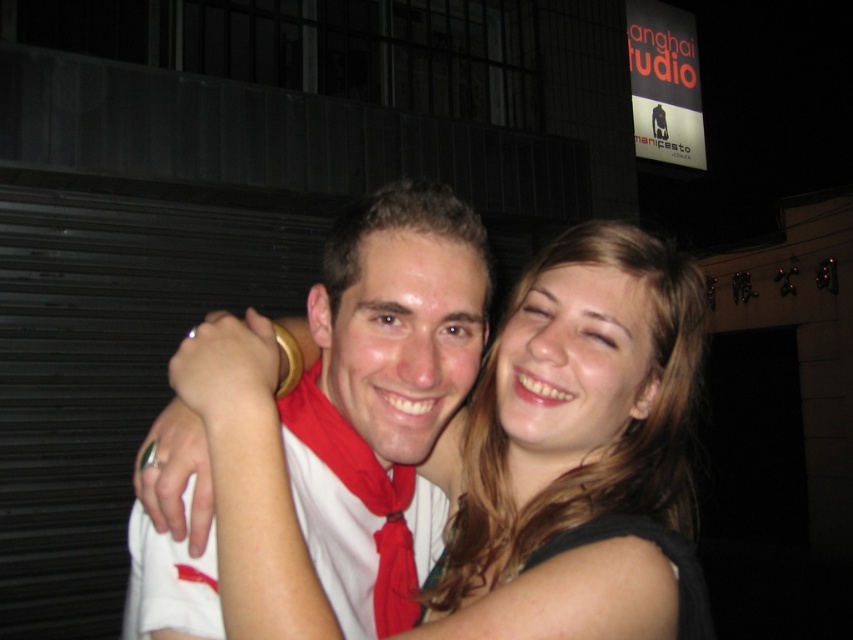
Question: Among these objects, which one is nearest to the camera?

Choices:
 (A) white matte shirt at center
 (B) blonde hair at center

Answer: (B)

Question: From the image, what is the correct spatial relationship of blonde hair at center in relation to white matte shirt at center?

Choices:
 (A) below
 (B) above

Answer: (A)

Question: Which object appears farthest from the camera in this image?

Choices:
 (A) blonde hair at center
 (B) white matte shirt at center

Answer: (B)

Question: Which point is closer to the camera?

Choices:
 (A) white matte shirt at center
 (B) blonde hair at center

Answer: (B)

Question: Can you confirm if blonde hair at center is wider than white matte shirt at center?

Choices:
 (A) yes
 (B) no

Answer: (A)

Question: Considering the relative positions of blonde hair at center and white matte shirt at center in the image provided, where is blonde hair at center located with respect to white matte shirt at center?

Choices:
 (A) left
 (B) right

Answer: (B)